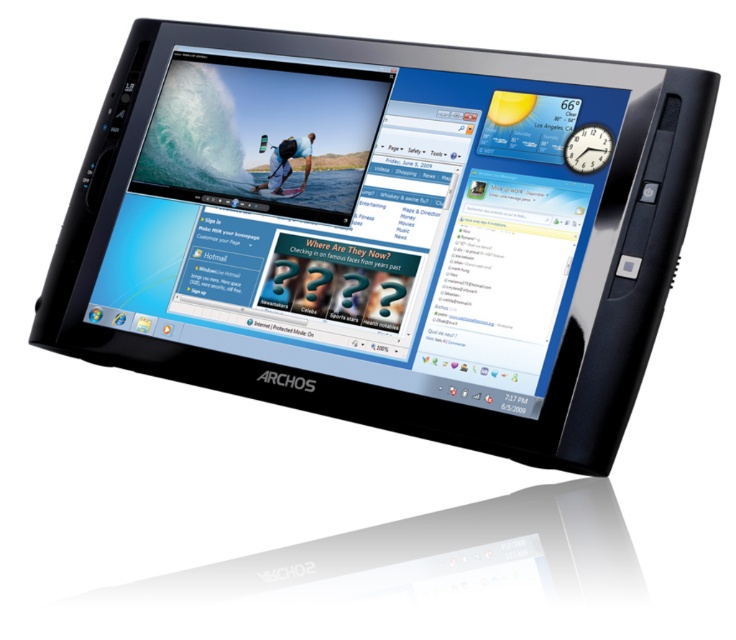
Describe the element at coordinates (383, 232) in the screenshot. Image resolution: width=736 pixels, height=640 pixels. I see `black plastic tablet at center` at that location.

Describe the element at coordinates (383, 232) in the screenshot. The width and height of the screenshot is (736, 640). I see `black plastic tablet at center` at that location.

You are a GUI agent. You are given a task and a screenshot of the screen. Output one action in this format:
    pyautogui.click(x=<x>, y=<y>)
    Task: Click on the black plastic tablet at center
    This screenshot has height=640, width=736.
    Given the screenshot: What is the action you would take?
    pyautogui.click(x=383, y=232)